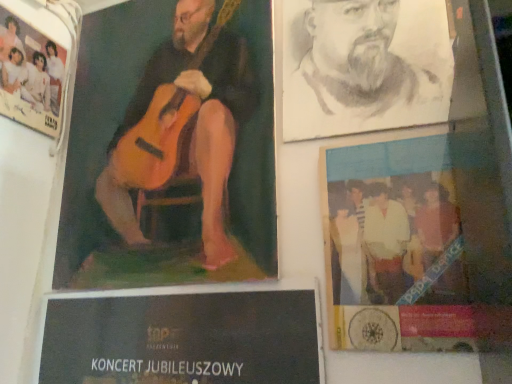
What is the approximate width of white paper poster at upper left, acting as the 3th poster starting from the right?

1.24 inches.

Identify the location of charcoal portrait of man at upper right. This screenshot has height=384, width=512. (364, 66).

Is white paper poster at upper left, arranged as the first poster when viewed from the left, positioned beyond the bounds of wooden guitar at upper left, the 2th poster in the right-to-left sequence?

Yes, white paper poster at upper left, arranged as the first poster when viewed from the left, is located beyond the bounds of wooden guitar at upper left, the 2th poster in the right-to-left sequence.

Considering the points (42, 78) and (241, 132), which point is in front, point (42, 78) or point (241, 132)?

Positioned in front is point (241, 132).

Which object is thinner, white paper poster at upper left, acting as the 3th poster starting from the right, or wooden guitar at upper left, the 2th poster in the right-to-left sequence?

With smaller width is wooden guitar at upper left, the 2th poster in the right-to-left sequence.

Would you say white paper poster at upper left, acting as the 3th poster starting from the right, is to the left or to the right of wooden guitar at upper left, the 2th poster in the right-to-left sequence, in the picture?

In the image, white paper poster at upper left, acting as the 3th poster starting from the right, appears on the left side of wooden guitar at upper left, the 2th poster in the right-to-left sequence.

Based on their sizes in the image, would you say charcoal portrait of man at upper right is bigger or smaller than wooden guitar at upper left, positioned as the second poster in left-to-right order?

charcoal portrait of man at upper right is smaller than wooden guitar at upper left, positioned as the second poster in left-to-right order.

In the scene shown: Does charcoal portrait of man at upper right lie in front of wooden guitar at upper left, positioned as the second poster in left-to-right order?

A: Yes, charcoal portrait of man at upper right is in front of wooden guitar at upper left, positioned as the second poster in left-to-right order.

Is charcoal portrait of man at upper right wider than wooden guitar at upper left, the 2th poster in the right-to-left sequence?

Correct, the width of charcoal portrait of man at upper right exceeds that of wooden guitar at upper left, the 2th poster in the right-to-left sequence.

Between charcoal portrait of man at upper right and wooden guitar at upper left, the 2th poster in the right-to-left sequence, which one has more height?

wooden guitar at upper left, the 2th poster in the right-to-left sequence, is taller.

From the image's perspective, who appears lower, wooden guitar at upper left, the 2th poster in the right-to-left sequence, or blue glossy poster at lower right, which ranks as the 3th poster in left-to-right order?

blue glossy poster at lower right, which ranks as the 3th poster in left-to-right order, appears lower in the image.

Is blue glossy poster at lower right, which ranks as the 3th poster in left-to-right order, inside wooden guitar at upper left, the 2th poster in the right-to-left sequence?

That's incorrect, blue glossy poster at lower right, which ranks as the 3th poster in left-to-right order, is not inside wooden guitar at upper left, the 2th poster in the right-to-left sequence.

Is wooden guitar at upper left, positioned as the second poster in left-to-right order, behind blue glossy poster at lower right, which ranks as the 1th poster in right-to-left order?

That is True.

From the picture: Can you confirm if wooden guitar at upper left, the 2th poster in the right-to-left sequence, is taller than blue glossy poster at lower right, which ranks as the 3th poster in left-to-right order?

Yes, wooden guitar at upper left, the 2th poster in the right-to-left sequence, is taller than blue glossy poster at lower right, which ranks as the 3th poster in left-to-right order.

Based on the photo, does blue glossy poster at lower right, which ranks as the 3th poster in left-to-right order, have a lesser height compared to wooden guitar at upper left, the 2th poster in the right-to-left sequence?

Yes.

How far apart are blue glossy poster at lower right, which ranks as the 3th poster in left-to-right order, and wooden guitar at upper left, positioned as the second poster in left-to-right order?

blue glossy poster at lower right, which ranks as the 3th poster in left-to-right order, is 13.22 inches away from wooden guitar at upper left, positioned as the second poster in left-to-right order.

Starting from the blue glossy poster at lower right, which ranks as the 3th poster in left-to-right order, which poster is the 1st one to the left? Please provide its 2D coordinates.

[(170, 148)]

Identify the location of man located on the right of wooden guitar at upper left, the 2th poster in the right-to-left sequence. This screenshot has width=512, height=384. (364, 66).

Is wooden guitar at upper left, the 2th poster in the right-to-left sequence, beside charcoal portrait of man at upper right?

No.

Does wooden guitar at upper left, the 2th poster in the right-to-left sequence, contain charcoal portrait of man at upper right?

No, charcoal portrait of man at upper right is not surrounded by wooden guitar at upper left, the 2th poster in the right-to-left sequence.

Does white paper poster at upper left, arranged as the first poster when viewed from the left, appear on the right side of blue glossy poster at lower right, which ranks as the 1th poster in right-to-left order?

No.

From the image's perspective, would you say white paper poster at upper left, acting as the 3th poster starting from the right, is positioned over blue glossy poster at lower right, which ranks as the 3th poster in left-to-right order?

Yes, from the image's perspective, white paper poster at upper left, acting as the 3th poster starting from the right, is on top of blue glossy poster at lower right, which ranks as the 3th poster in left-to-right order.

Is point (45, 75) farther from camera compared to point (489, 321)?

Yes, point (45, 75) is behind point (489, 321).

Would you say white paper poster at upper left, arranged as the first poster when viewed from the left, is outside blue glossy poster at lower right, which ranks as the 1th poster in right-to-left order?

white paper poster at upper left, arranged as the first poster when viewed from the left, lies outside blue glossy poster at lower right, which ranks as the 1th poster in right-to-left order,'s area.

How distant is blue glossy poster at lower right, which ranks as the 1th poster in right-to-left order, from white paper poster at upper left, acting as the 3th poster starting from the right?

90.04 centimeters.

From a real-world perspective, relative to white paper poster at upper left, arranged as the first poster when viewed from the left, is blue glossy poster at lower right, which ranks as the 3th poster in left-to-right order, vertically above or below?

In terms of real-world spatial position, blue glossy poster at lower right, which ranks as the 3th poster in left-to-right order, is below white paper poster at upper left, arranged as the first poster when viewed from the left.

Does point (416, 182) come in front of point (13, 112)?

Yes, it is in front of point (13, 112).

Looking at this image, based on their positions, is blue glossy poster at lower right, which ranks as the 1th poster in right-to-left order, located to the left or right of white paper poster at upper left, acting as the 3th poster starting from the right?

From the image, it's evident that blue glossy poster at lower right, which ranks as the 1th poster in right-to-left order, is to the right of white paper poster at upper left, acting as the 3th poster starting from the right.

Where is `poster above the wooden guitar at upper left, positioned as the second poster in left-to-right order (from the image's perspective)`? The width and height of the screenshot is (512, 384). poster above the wooden guitar at upper left, positioned as the second poster in left-to-right order (from the image's perspective) is located at coordinates (32, 75).

You are a GUI agent. You are given a task and a screenshot of the screen. Output one action in this format:
    pyautogui.click(x=<x>, y=<y>)
    Task: Click on the man above the wooden guitar at upper left, positioned as the second poster in left-to-right order (from a real-world perspective)
    The height and width of the screenshot is (384, 512).
    Given the screenshot: What is the action you would take?
    pyautogui.click(x=364, y=66)

From the image, which object appears to be nearer to wooden guitar at upper left, the 2th poster in the right-to-left sequence, white paper poster at upper left, acting as the 3th poster starting from the right, or charcoal portrait of man at upper right?

The object closer to wooden guitar at upper left, the 2th poster in the right-to-left sequence, is charcoal portrait of man at upper right.

Consider the image. Estimate the real-world distances between objects in this image. Which object is closer to wooden guitar at upper left, positioned as the second poster in left-to-right order, blue glossy poster at lower right, which ranks as the 1th poster in right-to-left order, or white paper poster at upper left, arranged as the first poster when viewed from the left?

The object closer to wooden guitar at upper left, positioned as the second poster in left-to-right order, is white paper poster at upper left, arranged as the first poster when viewed from the left.

Estimate the real-world distances between objects in this image. Which object is further from charcoal portrait of man at upper right, white paper poster at upper left, acting as the 3th poster starting from the right, or wooden guitar at upper left, positioned as the second poster in left-to-right order?

white paper poster at upper left, acting as the 3th poster starting from the right.

Which object lies further to the anchor point wooden guitar at upper left, positioned as the second poster in left-to-right order, white paper poster at upper left, arranged as the first poster when viewed from the left, or blue glossy poster at lower right, which ranks as the 3th poster in left-to-right order?

Among the two, blue glossy poster at lower right, which ranks as the 3th poster in left-to-right order, is located further to wooden guitar at upper left, positioned as the second poster in left-to-right order.

Which object lies further to the anchor point charcoal portrait of man at upper right, blue glossy poster at lower right, which ranks as the 1th poster in right-to-left order, or white paper poster at upper left, arranged as the first poster when viewed from the left?

Based on the image, white paper poster at upper left, arranged as the first poster when viewed from the left, appears to be further to charcoal portrait of man at upper right.

Based on their spatial positions, is blue glossy poster at lower right, which ranks as the 1th poster in right-to-left order, or charcoal portrait of man at upper right closer to white paper poster at upper left, arranged as the first poster when viewed from the left?

charcoal portrait of man at upper right lies closer to white paper poster at upper left, arranged as the first poster when viewed from the left, than the other object.

From the image, which object appears to be farther from white paper poster at upper left, acting as the 3th poster starting from the right, wooden guitar at upper left, positioned as the second poster in left-to-right order, or blue glossy poster at lower right, which ranks as the 1th poster in right-to-left order?

blue glossy poster at lower right, which ranks as the 1th poster in right-to-left order, is further to white paper poster at upper left, acting as the 3th poster starting from the right.

Which object lies nearer to the anchor point blue glossy poster at lower right, which ranks as the 3th poster in left-to-right order, wooden guitar at upper left, positioned as the second poster in left-to-right order, or charcoal portrait of man at upper right?

Among the two, charcoal portrait of man at upper right is located nearer to blue glossy poster at lower right, which ranks as the 3th poster in left-to-right order.

You are a GUI agent. You are given a task and a screenshot of the screen. Output one action in this format:
    pyautogui.click(x=<x>, y=<y>)
    Task: Click on the man between wooden guitar at upper left, positioned as the second poster in left-to-right order, and blue glossy poster at lower right, which ranks as the 1th poster in right-to-left order
    This screenshot has height=384, width=512.
    Given the screenshot: What is the action you would take?
    pyautogui.click(x=364, y=66)

The height and width of the screenshot is (384, 512). What are the coordinates of `man situated between white paper poster at upper left, acting as the 3th poster starting from the right, and blue glossy poster at lower right, which ranks as the 1th poster in right-to-left order, from left to right` in the screenshot? It's located at (364, 66).

The image size is (512, 384). What are the coordinates of `poster between white paper poster at upper left, arranged as the first poster when viewed from the left, and blue glossy poster at lower right, which ranks as the 1th poster in right-to-left order, in the horizontal direction` in the screenshot? It's located at (170, 148).

Find the location of a particular element. poster located between white paper poster at upper left, arranged as the first poster when viewed from the left, and charcoal portrait of man at upper right in the left-right direction is located at coordinates (170, 148).